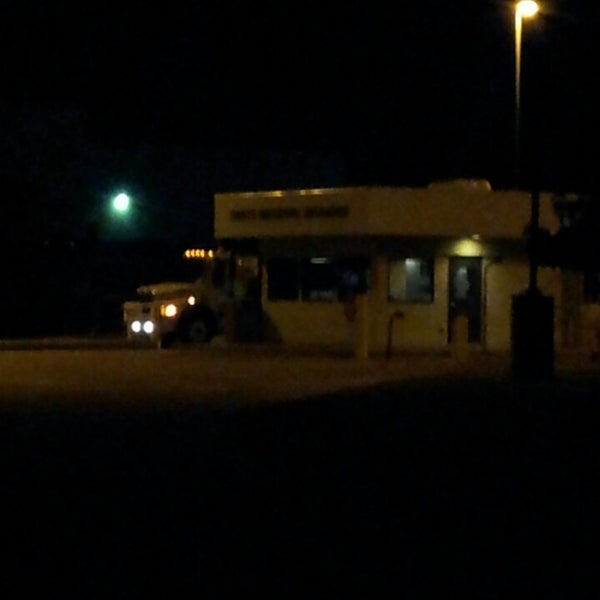
In order to click on windows in this screenshot , I will do `click(195, 271)`, `click(275, 282)`, `click(317, 282)`, `click(408, 287)`, `click(460, 280)`.